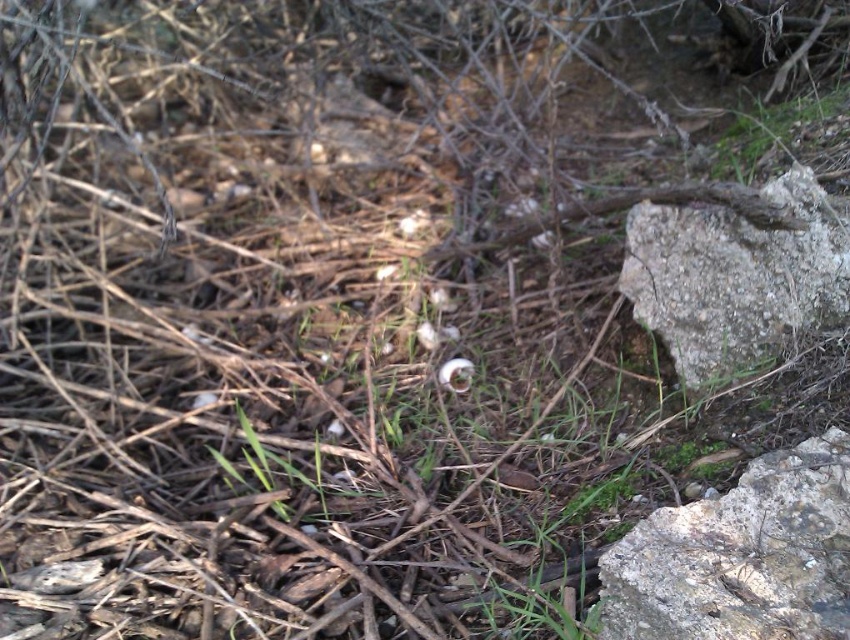
Question: Which point is farther from the camera taking this photo?

Choices:
 (A) (817, 451)
 (B) (700, 205)
 (C) (472, 364)

Answer: (C)

Question: Can you confirm if gray rough rock at lower right is thinner than white matte flower at center?

Choices:
 (A) yes
 (B) no

Answer: (B)

Question: Is gray rough rock at lower right behind white matte flower at center?

Choices:
 (A) yes
 (B) no

Answer: (B)

Question: Which object appears closest to the camera in this image?

Choices:
 (A) gray rough rock at right
 (B) gray rough rock at lower right
 (C) white matte flower at center

Answer: (B)

Question: Is gray rough rock at lower right closer to the viewer compared to white matte flower at center?

Choices:
 (A) yes
 (B) no

Answer: (A)

Question: Which point is closer to the camera taking this photo?

Choices:
 (A) pos(693,289)
 (B) pos(745,492)

Answer: (B)